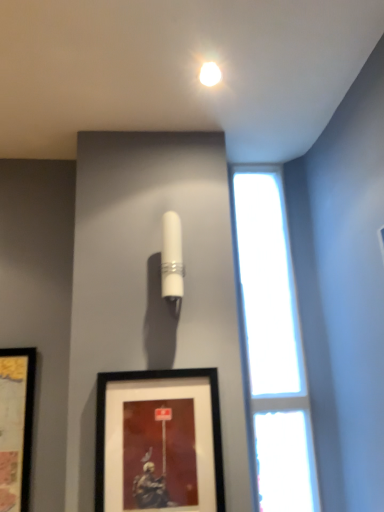
Question: Is point (215, 75) closer or farther from the camera than point (192, 398)?

Choices:
 (A) farther
 (B) closer

Answer: (A)

Question: Is matte white light bulb at upper center bigger or smaller than black matte picture frame at lower center?

Choices:
 (A) big
 (B) small

Answer: (B)

Question: Considering the real-world distances, which object is closest to the matte white light bulb at upper center?

Choices:
 (A) white glossy cylinder at upper center
 (B) transparent glass window at right
 (C) black matte picture frame at lower center

Answer: (A)

Question: Which object is the farthest from the white glossy cylinder at upper center?

Choices:
 (A) matte white light bulb at upper center
 (B) transparent glass window at right
 (C) black matte picture frame at lower center

Answer: (A)